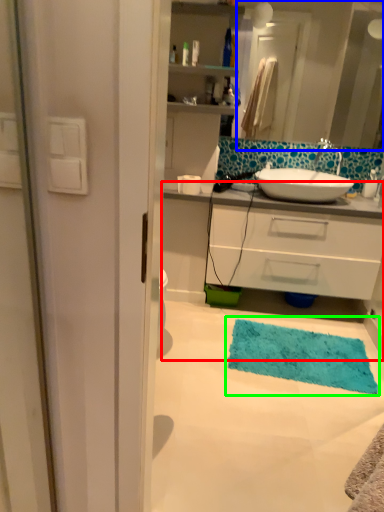
Question: Which object is positioned closest to bathroom cabinet (highlighted by a red box)? Select from mirror (highlighted by a blue box) and bath mat (highlighted by a green box).

Choices:
 (A) mirror
 (B) bath mat

Answer: (B)